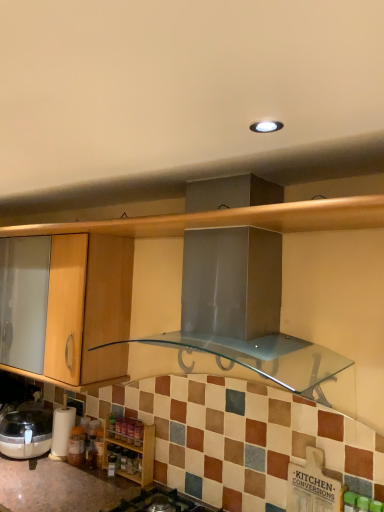
Question: Is wooden spice rack at lower left at the left side of white paper towel holder at lower left?

Choices:
 (A) no
 (B) yes

Answer: (A)

Question: Is wooden spice rack at lower left next to white paper towel holder at lower left?

Choices:
 (A) no
 (B) yes

Answer: (A)

Question: Is wooden spice rack at lower left thinner than white paper towel holder at lower left?

Choices:
 (A) no
 (B) yes

Answer: (B)

Question: Is wooden spice rack at lower left bigger than white paper towel holder at lower left?

Choices:
 (A) yes
 (B) no

Answer: (A)

Question: Does wooden spice rack at lower left lie behind white paper towel holder at lower left?

Choices:
 (A) no
 (B) yes

Answer: (A)

Question: From the image's perspective, is wooden spice rack at lower left positioned above or below white paper towel holder at lower left?

Choices:
 (A) above
 (B) below

Answer: (B)

Question: Is wooden spice rack at lower left bigger or smaller than white paper towel holder at lower left?

Choices:
 (A) small
 (B) big

Answer: (B)

Question: Is point (135, 464) positioned closer to the camera than point (52, 421)?

Choices:
 (A) farther
 (B) closer

Answer: (B)

Question: In the image, is wooden spice rack at lower left on the left side or the right side of white paper towel holder at lower left?

Choices:
 (A) left
 (B) right

Answer: (B)

Question: Considering the positions of black glass gas stove at lower center and wooden spice rack at lower left in the image, is black glass gas stove at lower center bigger or smaller than wooden spice rack at lower left?

Choices:
 (A) small
 (B) big

Answer: (B)

Question: Is black glass gas stove at lower center spatially inside wooden spice rack at lower left, or outside of it?

Choices:
 (A) outside
 (B) inside

Answer: (A)

Question: Is black glass gas stove at lower center to the left or to the right of wooden spice rack at lower left in the image?

Choices:
 (A) left
 (B) right

Answer: (B)

Question: From the image's perspective, is black glass gas stove at lower center located above or below wooden spice rack at lower left?

Choices:
 (A) below
 (B) above

Answer: (A)

Question: In terms of height, does white paper towel holder at lower left look taller or shorter compared to wooden spice rack at lower left?

Choices:
 (A) short
 (B) tall

Answer: (B)

Question: Is white paper towel holder at lower left bigger or smaller than wooden spice rack at lower left?

Choices:
 (A) small
 (B) big

Answer: (A)